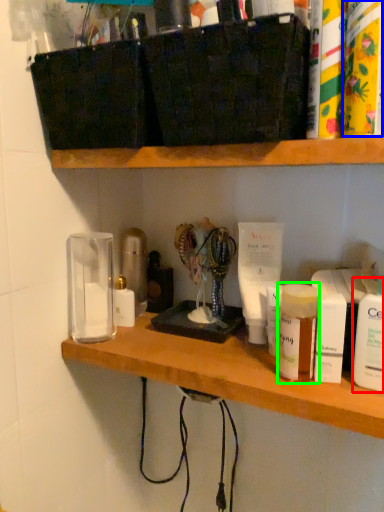
Question: Estimate the real-world distances between objects in this image. Which object is farther from toiletry (highlighted by a red box), toiletry (highlighted by a blue box) or toiletry (highlighted by a green box)?

Choices:
 (A) toiletry
 (B) toiletry

Answer: (A)